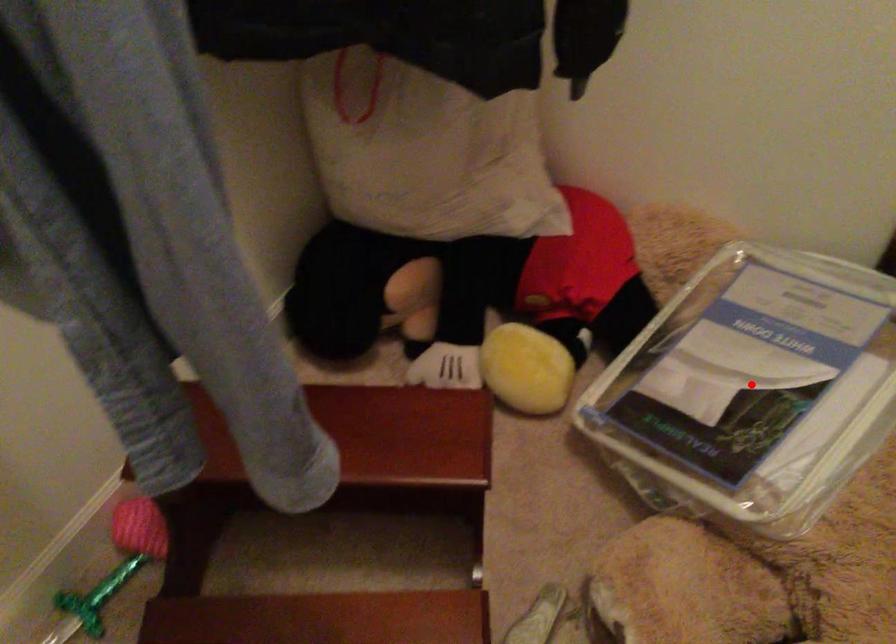
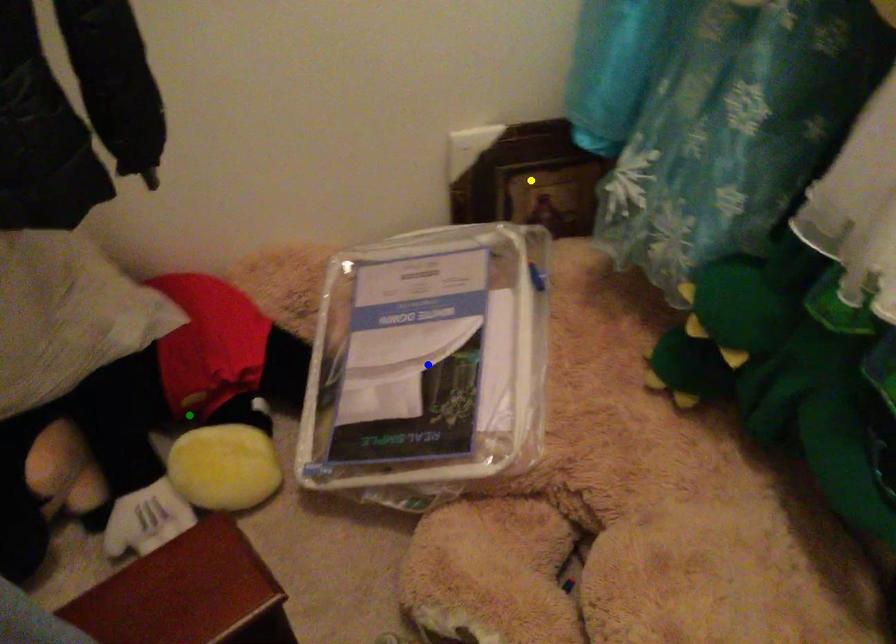
Question: I am providing you with two images of the same scene from different viewpoints. A red point is marked on the first image. You are given multiple points on the second image. In image 2, which mark is for the same physical point as the one in image 1?

Choices:
 (A) yellow point
 (B) green point
 (C) blue point

Answer: (C)